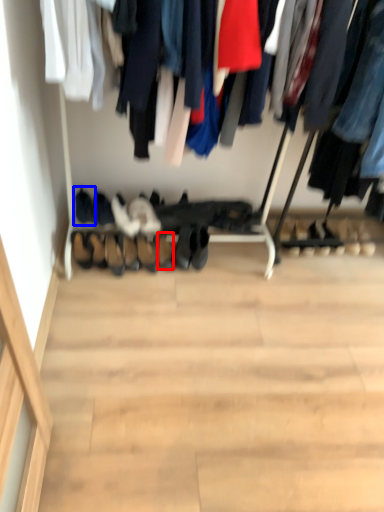
Question: Which object appears farthest to the camera in this image, shoe (highlighted by a red box) or footwear (highlighted by a blue box)?

Choices:
 (A) shoe
 (B) footwear

Answer: (B)